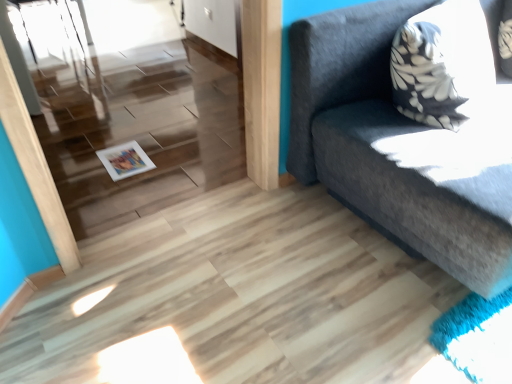
Question: From the image's perspective, would you say dark gray fabric couch at upper right is positioned over white glossy door at upper center?

Choices:
 (A) yes
 (B) no

Answer: (B)

Question: Is dark gray fabric couch at upper right further to camera compared to white glossy door at upper center?

Choices:
 (A) yes
 (B) no

Answer: (B)

Question: Is dark gray fabric couch at upper right bigger than white glossy door at upper center?

Choices:
 (A) no
 (B) yes

Answer: (B)

Question: Does dark gray fabric couch at upper right have a lesser width compared to white glossy door at upper center?

Choices:
 (A) yes
 (B) no

Answer: (B)

Question: Is dark gray fabric couch at upper right outside white glossy door at upper center?

Choices:
 (A) yes
 (B) no

Answer: (A)

Question: Does dark gray fabric couch at upper right have a greater height compared to white glossy door at upper center?

Choices:
 (A) no
 (B) yes

Answer: (B)

Question: From a real-world perspective, does white glossy magazine at lower left stand above dark gray fabric couch at upper right?

Choices:
 (A) no
 (B) yes

Answer: (A)

Question: From a real-world perspective, is white glossy magazine at lower left positioned under dark gray fabric couch at upper right based on gravity?

Choices:
 (A) no
 (B) yes

Answer: (B)

Question: Is white glossy magazine at lower left positioned before dark gray fabric couch at upper right?

Choices:
 (A) yes
 (B) no

Answer: (B)

Question: Is white glossy magazine at lower left positioned behind dark gray fabric couch at upper right?

Choices:
 (A) no
 (B) yes

Answer: (B)

Question: Can you confirm if white glossy magazine at lower left is thinner than dark gray fabric couch at upper right?

Choices:
 (A) no
 (B) yes

Answer: (B)

Question: Is white glossy magazine at lower left in contact with dark gray fabric couch at upper right?

Choices:
 (A) yes
 (B) no

Answer: (B)

Question: Would you say white glossy door at upper center is outside dark gray fabric couch at upper right?

Choices:
 (A) no
 (B) yes

Answer: (B)